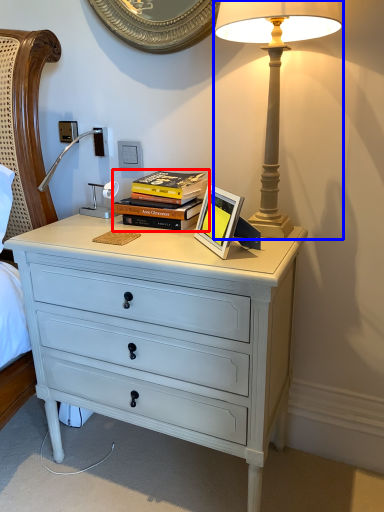
Question: Which object appears farthest to the camera in this image, book (highlighted by a red box) or lamp (highlighted by a blue box)?

Choices:
 (A) book
 (B) lamp

Answer: (A)